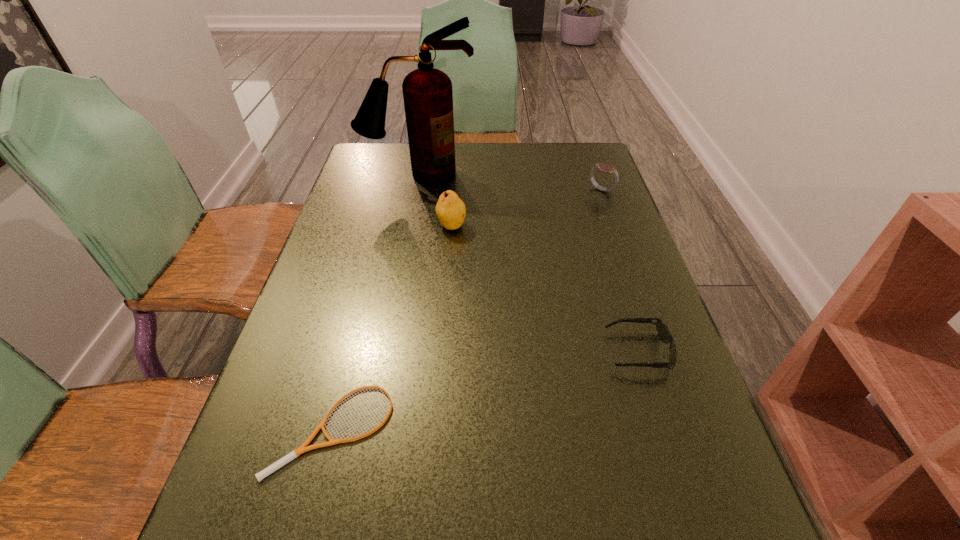
What are the coordinates of `object that is at the far left corner` in the screenshot? It's located at (427, 92).

Image resolution: width=960 pixels, height=540 pixels. In the image, there is a desktop. What are the coordinates of `vacant space at the far edge` in the screenshot? It's located at (551, 168).

In the image, there is a desktop. Identify the location of free region at the left edge. The height and width of the screenshot is (540, 960). (358, 293).

Identify the location of vacant area at the right edge of the desktop. This screenshot has height=540, width=960. (686, 509).

Identify the location of vacant point at the far left corner. This screenshot has width=960, height=540. (364, 153).

Locate an element on the screen. vacant space at the far right corner is located at coordinates (599, 172).

This screenshot has height=540, width=960. I want to click on empty space between the pear and the watch, so click(x=526, y=208).

Find the location of a particular element. vacant area that lies between the sunglasses and the watch is located at coordinates (619, 271).

The image size is (960, 540). What are the coordinates of `vacant area between the tallest object and the nearest object` in the screenshot? It's located at (377, 301).

The height and width of the screenshot is (540, 960). In order to click on vacant area that lies between the fire extinguisher and the third tallest object in this screenshot , I will do `click(510, 182)`.